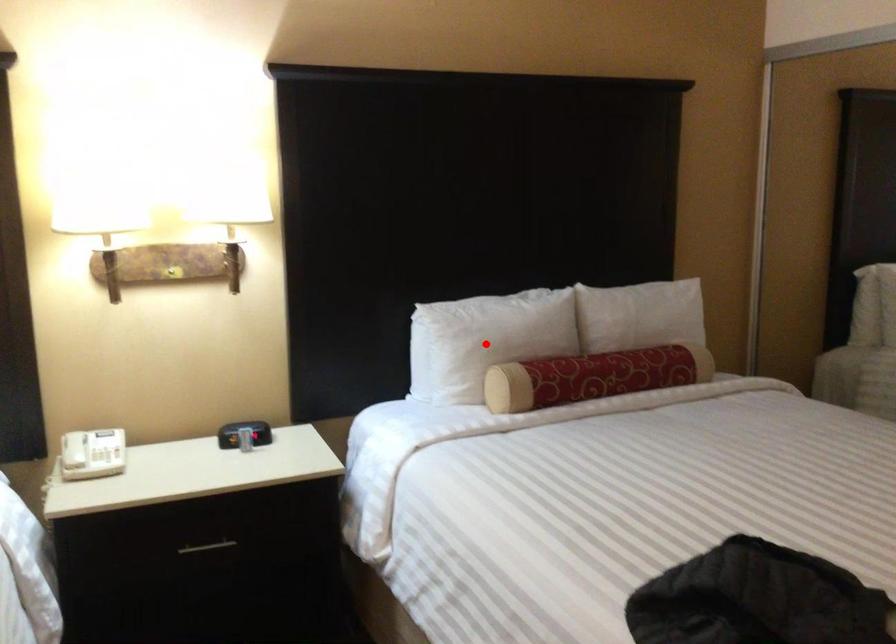
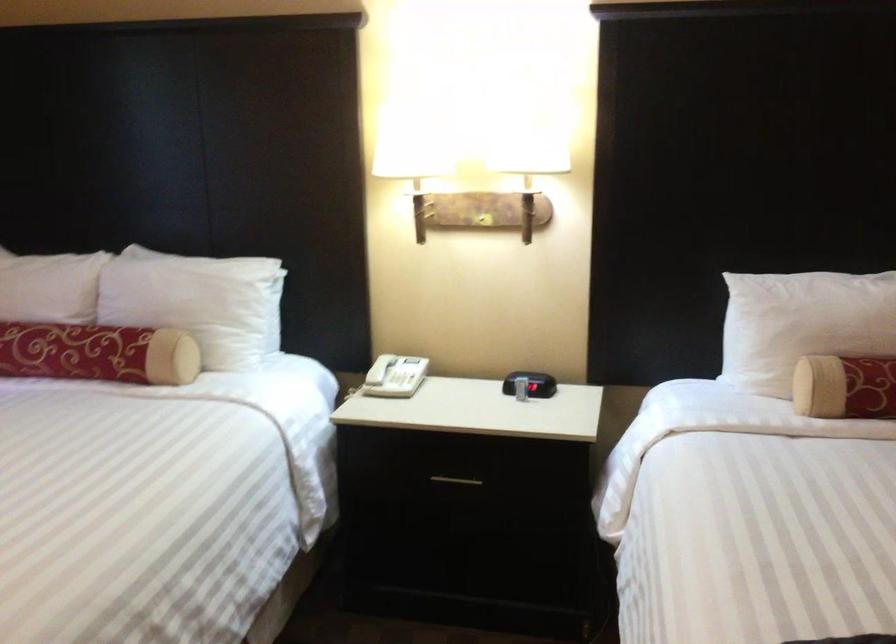
Locate, in the second image, the point that corresponds to the highlighted location in the first image.

(802, 324)